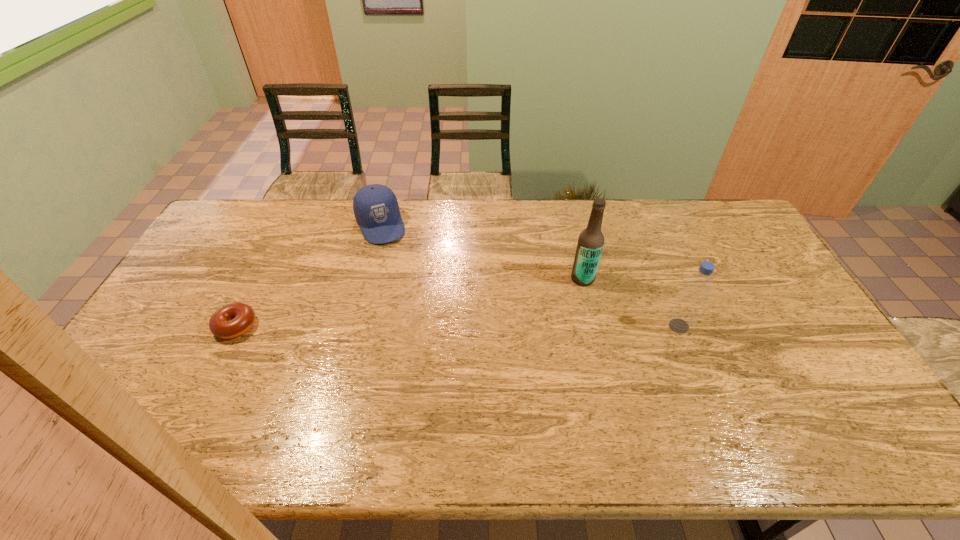
This screenshot has height=540, width=960. What are the coordinates of `free space located on the side of the second object from right to left with the label` in the screenshot? It's located at click(x=520, y=310).

At what (x,y) coordinates should I click in order to perform the action: click on free space located on the side of the second object from right to left with the label. Please return your answer as a coordinate pair (x, y). Looking at the image, I should click on (501, 320).

What are the coordinates of `vacant space located on the side of the second object from right to left with the label` in the screenshot? It's located at (531, 305).

This screenshot has width=960, height=540. Find the location of `vacant space located on the front-facing side of the second shortest object`. vacant space located on the front-facing side of the second shortest object is located at coordinates (421, 322).

You are a GUI agent. You are given a task and a screenshot of the screen. Output one action in this format:
    pyautogui.click(x=<x>, y=<y>)
    Task: Click on the free space located on the front-facing side of the second shortest object
    
    Given the screenshot: What is the action you would take?
    pyautogui.click(x=398, y=272)

Identify the location of free region located 0.160m on the front-facing side of the second shortest object. The height and width of the screenshot is (540, 960). (399, 274).

Where is `object that is positioned at the far edge`? object that is positioned at the far edge is located at coordinates (375, 206).

Locate an element on the screen. The height and width of the screenshot is (540, 960). vacant space at the far edge of the desktop is located at coordinates (433, 230).

The height and width of the screenshot is (540, 960). In the image, there is a desktop. In order to click on vacant area at the near edge in this screenshot , I will do `click(411, 394)`.

Image resolution: width=960 pixels, height=540 pixels. In the image, there is a desktop. Identify the location of vacant region at the left edge. (147, 352).